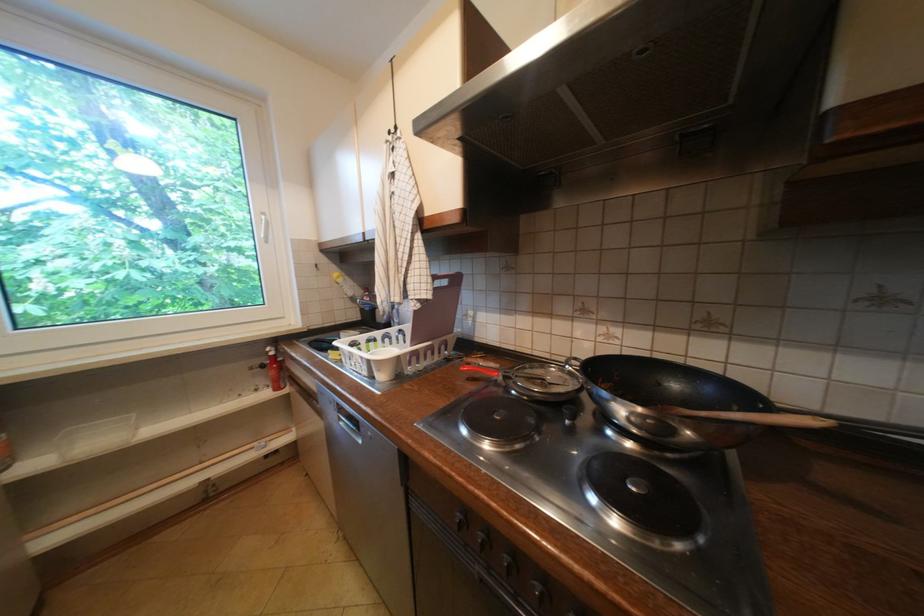
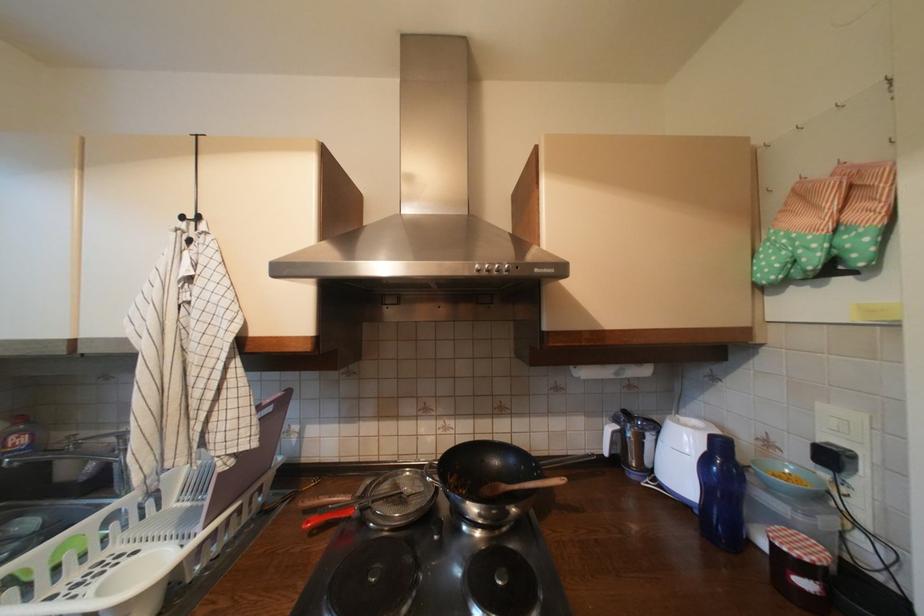
Where in the second image is the point corresponding to [553,381] from the first image?

(410, 495)